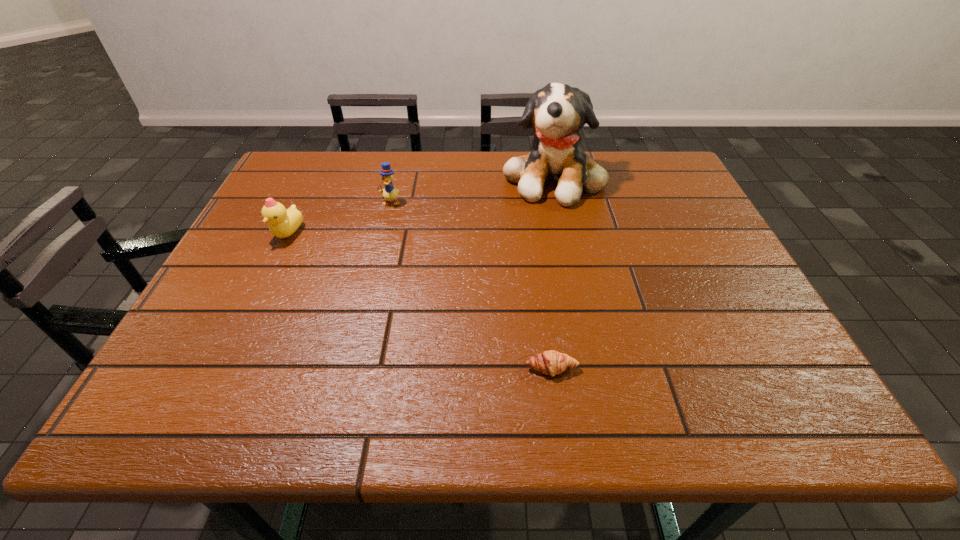
The width and height of the screenshot is (960, 540). In order to click on object present at the far edge in this screenshot , I will do `click(557, 112)`.

Where is `object positioned at the left edge`? This screenshot has width=960, height=540. object positioned at the left edge is located at coordinates (283, 222).

Identify the location of vacant space at the far edge of the desktop. The width and height of the screenshot is (960, 540). (455, 159).

Locate an element on the screen. The image size is (960, 540). free spot at the near edge of the desktop is located at coordinates (355, 390).

Where is `vacant area at the left edge`? This screenshot has height=540, width=960. vacant area at the left edge is located at coordinates (265, 224).

Locate an element on the screen. This screenshot has width=960, height=540. free space at the right edge of the desktop is located at coordinates (715, 267).

I want to click on free space at the far left corner, so click(320, 172).

Locate an element on the screen. vacant region at the near left corner of the desktop is located at coordinates (148, 415).

The image size is (960, 540). Identify the location of free space at the far right corner. (651, 151).

Locate an element on the screen. The width and height of the screenshot is (960, 540). free spot between the second object from left to right and the shortest object is located at coordinates (470, 285).